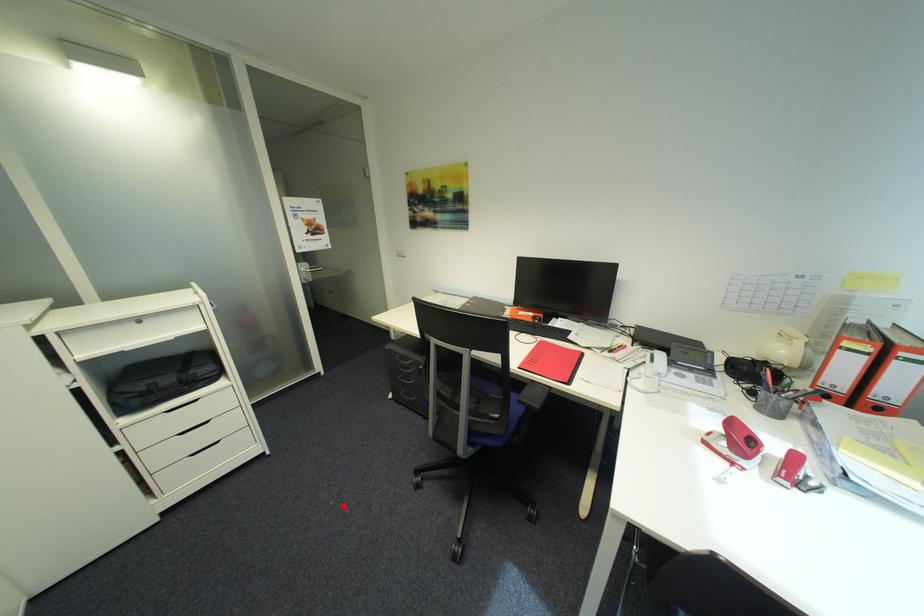
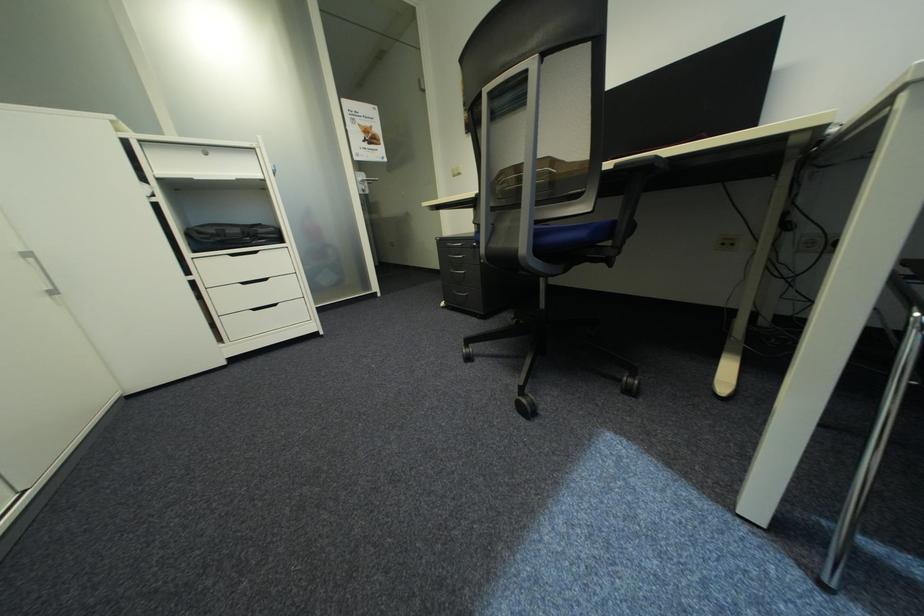
Where in the second image is the point corresponding to the highlighted location from the first image?

(384, 369)